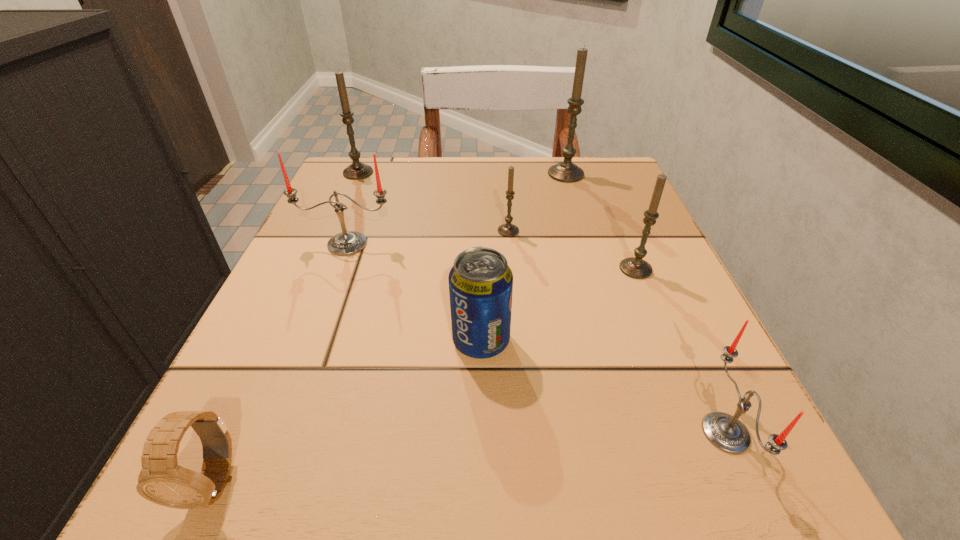
This screenshot has width=960, height=540. What are the coordinates of `vacant space that satisfies the following two spatial constraints: 1. on the front-facing side of the fifth farthest object; 2. on the left side of the farther red candle` in the screenshot? It's located at (338, 269).